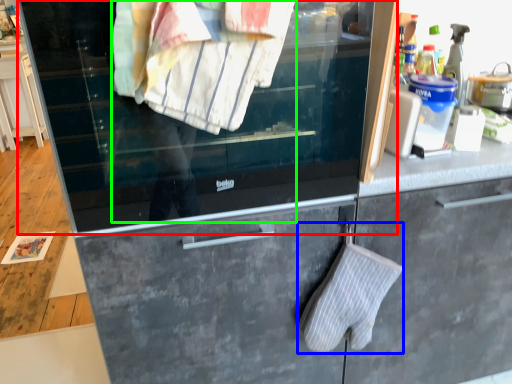
Question: Which object is the closest to the window (highlighted by a red box)? Choose among these: bath towel (highlighted by a blue box) or person (highlighted by a green box).

Choices:
 (A) bath towel
 (B) person

Answer: (B)